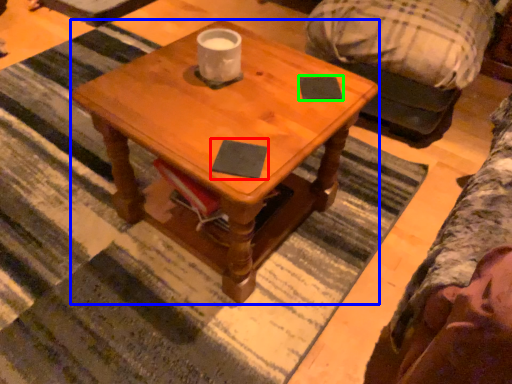
Question: Which object is positioned farthest from notepad (highlighted by a red box)? Select from coffee table (highlighted by a blue box) and notepad (highlighted by a green box).

Choices:
 (A) coffee table
 (B) notepad

Answer: (A)